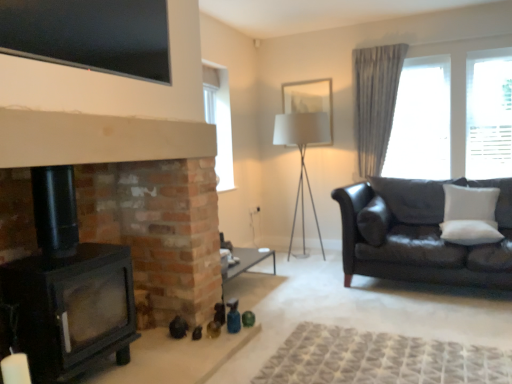
The width and height of the screenshot is (512, 384). I want to click on vacant space underneath black glass tv at upper center (from a real-world perspective), so click(x=87, y=108).